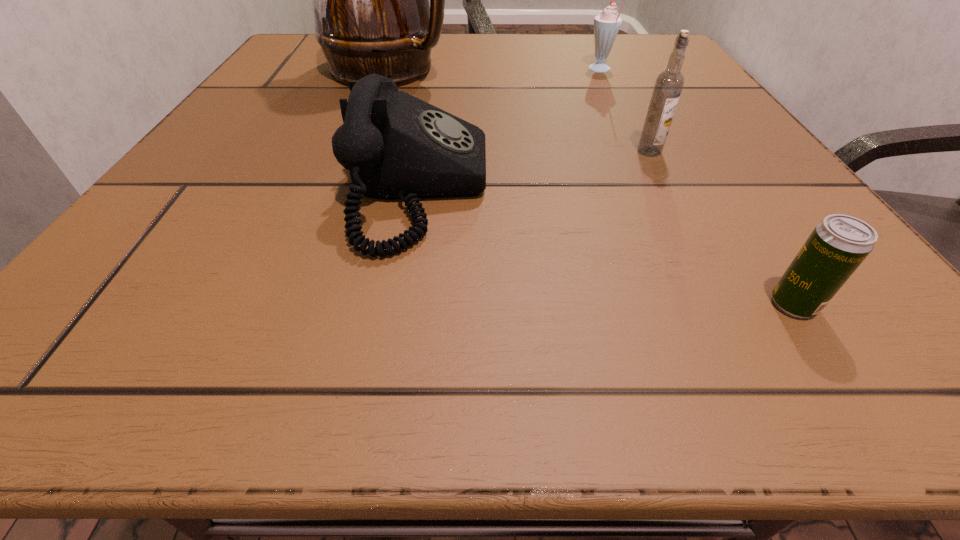
In order to click on object located at the far left corner in this screenshot , I will do `click(370, 0)`.

At what (x,y) coordinates should I click in order to perform the action: click on object that is at the far right corner. Please return your answer as a coordinate pair (x, y). Looking at the image, I should click on (606, 25).

The width and height of the screenshot is (960, 540). Identify the location of object that is at the near right corner. (837, 246).

The image size is (960, 540). In the image, there is a desktop. Find the location of `vacant area at the far edge`. vacant area at the far edge is located at coordinates (527, 62).

Find the location of `vacant space at the near edge of the desktop`. vacant space at the near edge of the desktop is located at coordinates (468, 323).

Where is `vacant region at the left edge`? The image size is (960, 540). vacant region at the left edge is located at coordinates (272, 133).

Identify the location of free space at the right edge. (761, 175).

In the image, there is a desktop. At what (x,y) coordinates should I click in order to perform the action: click on vacant space at the near left corner. Please return your answer as a coordinate pair (x, y). Looking at the image, I should click on (93, 343).

Where is `free space at the far right corner of the desktop`? This screenshot has height=540, width=960. free space at the far right corner of the desktop is located at coordinates (630, 51).

This screenshot has height=540, width=960. Find the location of `blank region between the pitcher and the second tallest object`. blank region between the pitcher and the second tallest object is located at coordinates (519, 110).